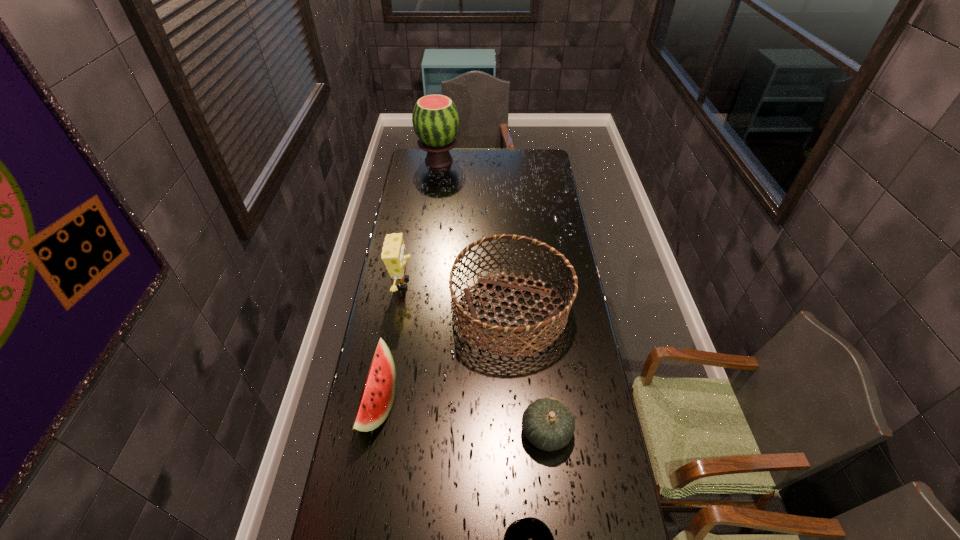
At what (x,y) coordinates should I click in order to perform the action: click on free space located on the outer rind of the nearer watermelon. Please return your answer as a coordinate pair (x, y). Looking at the image, I should click on point(414,404).

Locate an element on the screen. Image resolution: width=960 pixels, height=540 pixels. blank area located on the front of the gourd is located at coordinates (558, 530).

The image size is (960, 540). Find the location of `object that is at the far edge`. object that is at the far edge is located at coordinates (435, 118).

The image size is (960, 540). What are the coordinates of `sponge present at the left edge` in the screenshot? It's located at (393, 255).

Locate an element on the screen. This screenshot has height=540, width=960. basket located in the right edge section of the desktop is located at coordinates (554, 315).

This screenshot has height=540, width=960. In order to click on gourd that is positioned at the right edge in this screenshot , I will do `click(548, 424)`.

At what (x,y) coordinates should I click in order to perform the action: click on object present at the far left corner. Please return your answer as a coordinate pair (x, y). Looking at the image, I should click on (435, 118).

Where is `vacant space at the far edge of the desktop`? vacant space at the far edge of the desktop is located at coordinates (497, 151).

Image resolution: width=960 pixels, height=540 pixels. I want to click on vacant area at the left edge of the desktop, so click(x=409, y=367).

Image resolution: width=960 pixels, height=540 pixels. I want to click on free spot at the right edge of the desktop, so click(564, 400).